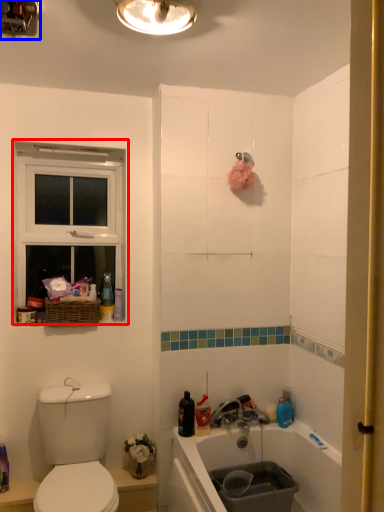
Question: Which object appears closest to the camera in this image, window (highlighted by a red box) or light fixture (highlighted by a blue box)?

Choices:
 (A) window
 (B) light fixture

Answer: (B)